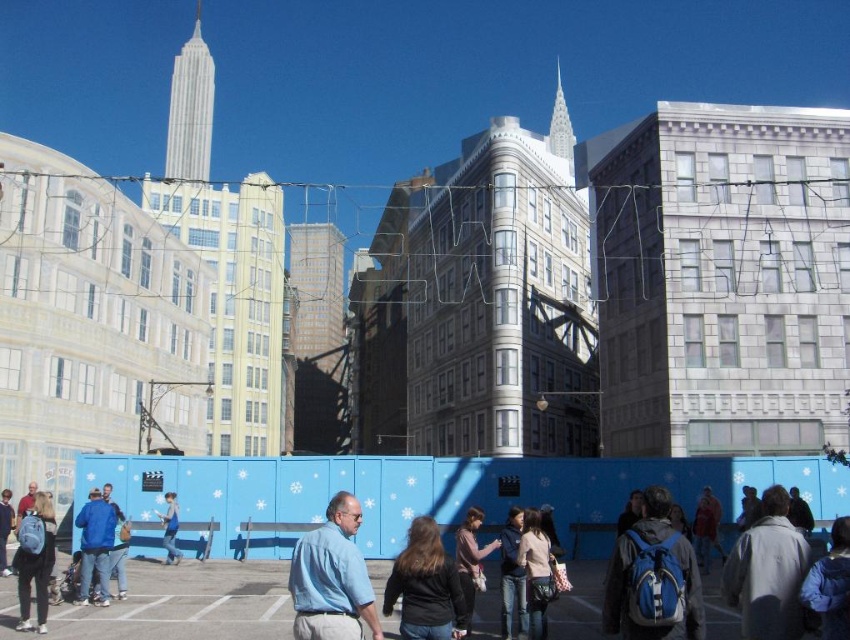
Question: Is light blue shirt at center closer to the viewer compared to blue denim jacket at center?

Choices:
 (A) yes
 (B) no

Answer: (A)

Question: Which of the following is the closest to the observer?

Choices:
 (A) blue denim jacket at lower left
 (B) light blue fabric at center
 (C) light blue shirt at center

Answer: (C)

Question: Is blue denim jacket at center closer to the viewer compared to light blue fabric at center?

Choices:
 (A) yes
 (B) no

Answer: (A)

Question: Which of the following is the closest to the observer?

Choices:
 (A) (117, 579)
 (B) (86, 516)

Answer: (A)

Question: Among these points, which one is nearest to the camera?

Choices:
 (A) (x=123, y=525)
 (B) (x=88, y=552)
 (C) (x=348, y=589)

Answer: (C)

Question: Does light blue shirt at center appear under blue denim jacket at lower left?

Choices:
 (A) no
 (B) yes

Answer: (A)